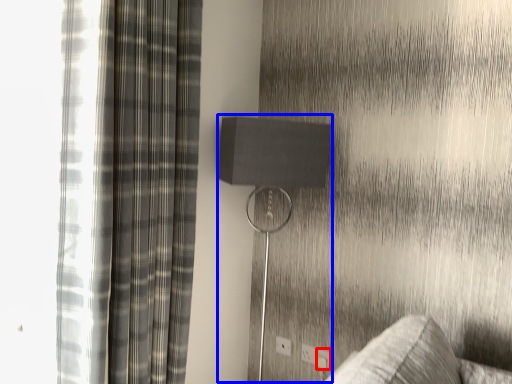
Question: Which point is further to the camera, electric outlet (highlighted by a red box) or table lamp (highlighted by a blue box)?

Choices:
 (A) electric outlet
 (B) table lamp

Answer: (A)